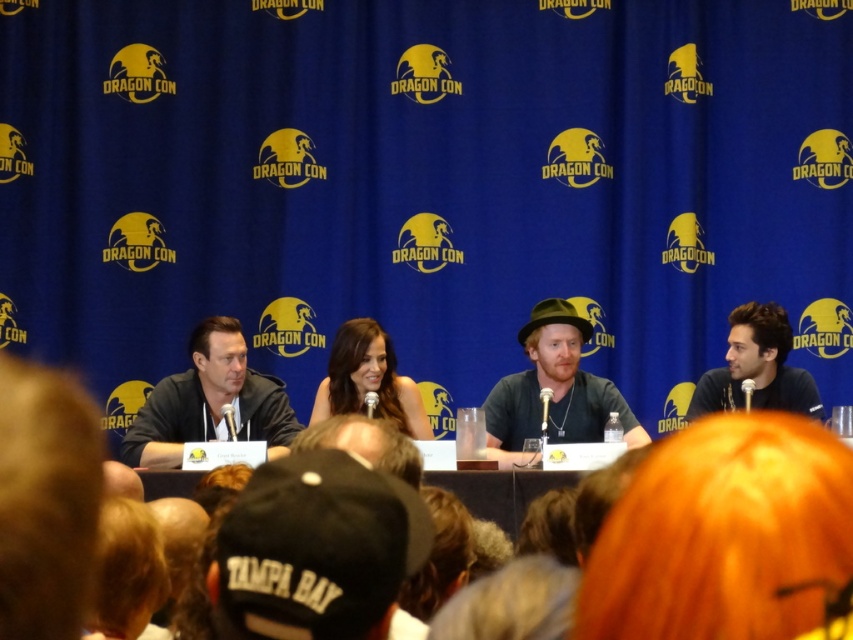
You are attending Dragon Con and standing at the front row, looking at the panel discussion. There are two points marked on the stage. Which of the two points, point (x=502, y=410) or point (x=801, y=376), is closer to you?

Point (x=502, y=410) is closer to the viewer than point (x=801, y=376).

You are an attendee at Dragon Con looking to take a photo of the panelists. You notice the black leather jacket at left and the smooth brown hair at center. Which object should you focus on first to ensure both are in the frame?

The black leather jacket at left is closer to the viewer than the smooth brown hair at center, so focus on the black leather jacket at left first to ensure both are in the frame.

You are an attendee at Dragon Con trying to take a photo of the panelists. You want to capture both the black leather jacket at left and the smooth brown hair at center in the same frame. Considering their widths, which object should you focus on to ensure both fit in the photo?

The black leather jacket at left is wider than the smooth brown hair at center, so focusing on the black leather jacket at left will ensure both objects fit in the photo since it occupies more space.